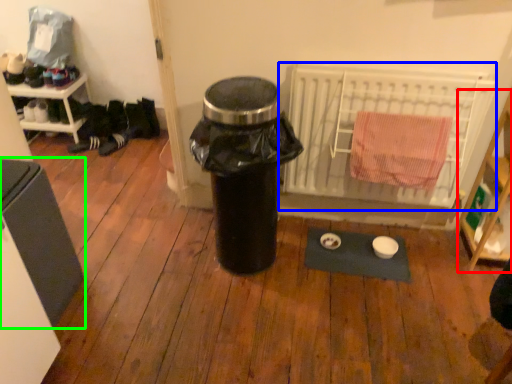
Question: Which object is the farthest from shelf (highlighted by a red box)? Choose among these: radiator (highlighted by a blue box) or furniture (highlighted by a green box).

Choices:
 (A) radiator
 (B) furniture

Answer: (B)